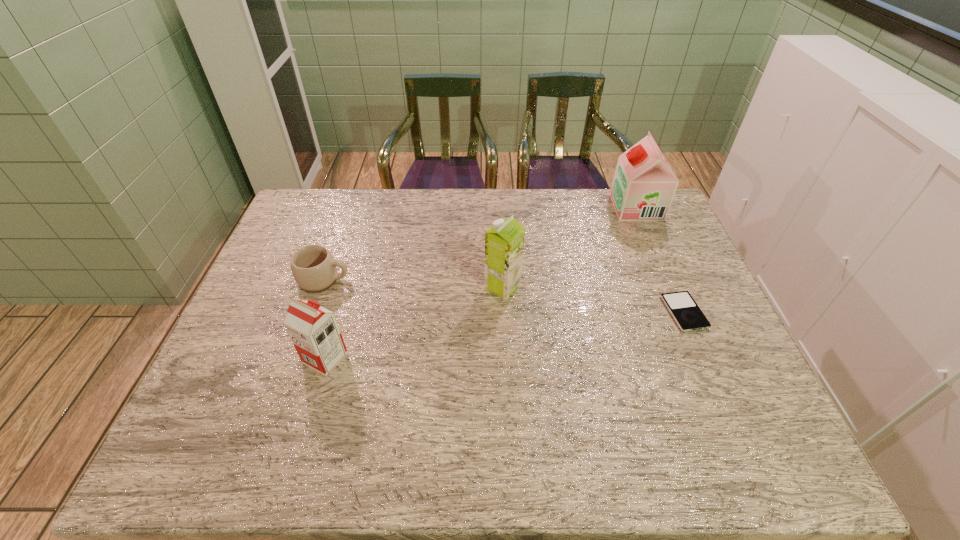
Where is `free space between the farthest object and the shortest object`? Image resolution: width=960 pixels, height=540 pixels. free space between the farthest object and the shortest object is located at coordinates (660, 260).

What are the coordinates of `vacant space in between the shortest object and the nearest soya milk` in the screenshot? It's located at (505, 335).

The width and height of the screenshot is (960, 540). I want to click on blank region between the leftmost soya milk and the second nearest soya milk, so click(414, 322).

The height and width of the screenshot is (540, 960). What are the coordinates of `free point between the rightmost soya milk and the shortest object` in the screenshot? It's located at (660, 260).

Locate an element on the screen. The height and width of the screenshot is (540, 960). object that stands as the closest to the rightmost soya milk is located at coordinates (685, 311).

This screenshot has height=540, width=960. I want to click on object that is the second closest to the third object from right to left, so click(x=685, y=311).

Select which soya milk is the third closest to the iPod. Please provide its 2D coordinates. Your answer should be formatted as a tuple, i.e. [(x, y)], where the tuple contains the x and y coordinates of a point satisfying the conditions above.

[(314, 331)]

You are a GUI agent. You are given a task and a screenshot of the screen. Output one action in this format:
    pyautogui.click(x=<x>, y=<y>)
    Task: Click on the soya milk that is the closest to the third object from left to right
    
    Given the screenshot: What is the action you would take?
    [x=314, y=331]

Identify the location of vacant region that satisfies the following two spatial constraints: 1. on the front side of the second soya milk from left to right; 2. on the right side of the iPod. (504, 313).

Image resolution: width=960 pixels, height=540 pixels. I want to click on vacant area that satisfies the following two spatial constraints: 1. on the back side of the iPod; 2. on the side of the mug with the handle, so click(x=670, y=280).